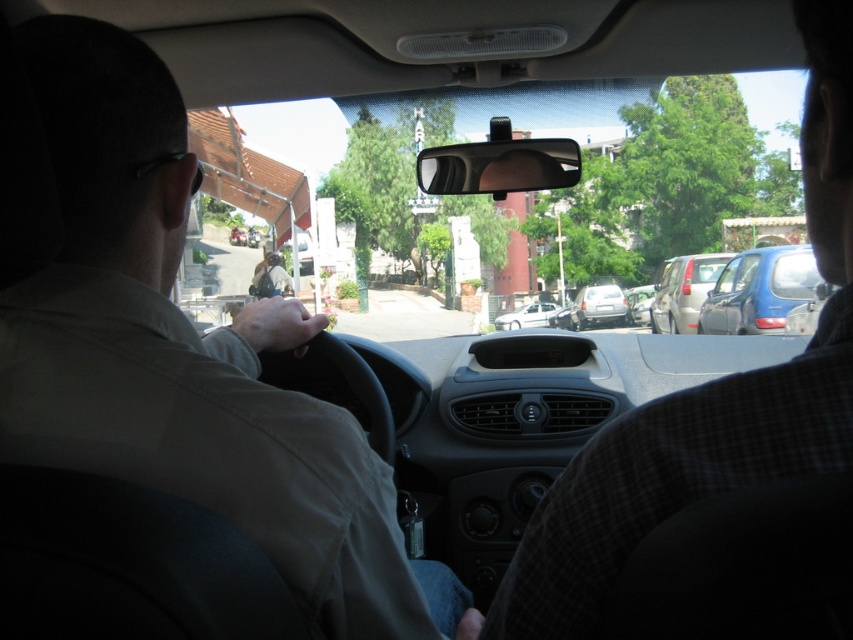
You are a passenger in the backseat of the car and want to know which vehicle is taller between the blue matte car at right and the white matte sedan at center. Can you determine this based on the view from your seat?

The blue matte car at right is taller than the white matte sedan at center according to the description.

You are sitting in the backseat of the car and want to reach the black glossy view mirror at center to adjust it. Considering your arm length is 0.7 meters, can you comfortably reach it?

The black glossy view mirror at center is 3.46 meters away from you. Since your arm length is only 0.7 meters, you cannot comfortably reach it.